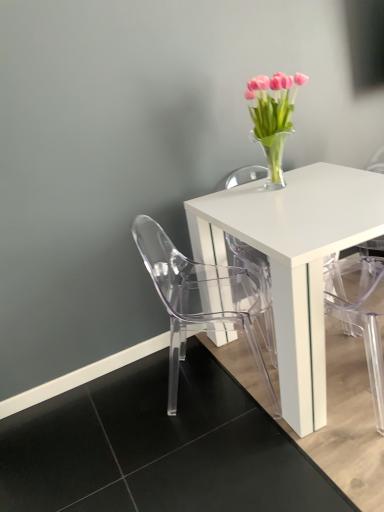
Question: Is transparent plastic chair at lower left a part of pink glass vase at upper right?

Choices:
 (A) no
 (B) yes

Answer: (A)

Question: Is pink glass vase at upper right bigger than transparent plastic chair at lower left?

Choices:
 (A) no
 (B) yes

Answer: (A)

Question: Is the position of pink glass vase at upper right less distant than that of transparent plastic chair at lower left?

Choices:
 (A) yes
 (B) no

Answer: (B)

Question: Considering the relative sizes of pink glass vase at upper right and transparent plastic chair at lower left in the image provided, is pink glass vase at upper right shorter than transparent plastic chair at lower left?

Choices:
 (A) yes
 (B) no

Answer: (A)

Question: Can you confirm if pink glass vase at upper right is taller than transparent plastic chair at lower left?

Choices:
 (A) no
 (B) yes

Answer: (A)

Question: Looking at the image, does transparent plastic armchair at lower right seem bigger or smaller compared to transparent plastic chair at lower left?

Choices:
 (A) small
 (B) big

Answer: (A)

Question: In terms of height, does transparent plastic armchair at lower right look taller or shorter compared to transparent plastic chair at lower left?

Choices:
 (A) short
 (B) tall

Answer: (B)

Question: Is transparent plastic armchair at lower right to the left or to the right of transparent plastic chair at lower left in the image?

Choices:
 (A) right
 (B) left

Answer: (A)

Question: Considering the positions of point (370, 288) and point (218, 302), is point (370, 288) closer or farther from the camera than point (218, 302)?

Choices:
 (A) closer
 (B) farther

Answer: (B)

Question: From a real-world perspective, is transparent plastic armchair at lower right above or below pink glass vase at upper right?

Choices:
 (A) above
 (B) below

Answer: (B)

Question: Do you think transparent plastic armchair at lower right is within pink glass vase at upper right, or outside of it?

Choices:
 (A) inside
 (B) outside

Answer: (B)

Question: Is transparent plastic armchair at lower right in front of or behind pink glass vase at upper right in the image?

Choices:
 (A) front
 (B) behind

Answer: (A)

Question: Looking at the image, does transparent plastic armchair at lower right seem bigger or smaller compared to pink glass vase at upper right?

Choices:
 (A) big
 (B) small

Answer: (A)

Question: From the image's perspective, is transparent plastic chair at lower left positioned above or below transparent plastic armchair at lower right?

Choices:
 (A) below
 (B) above

Answer: (A)

Question: Is transparent plastic chair at lower left inside the boundaries of transparent plastic armchair at lower right, or outside?

Choices:
 (A) inside
 (B) outside

Answer: (B)